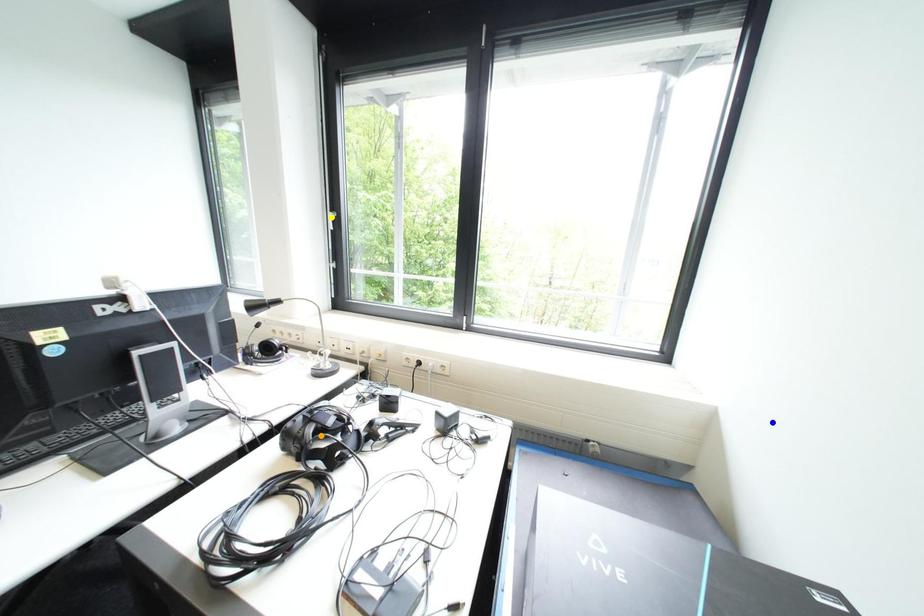
Order these from nearest to farthest:
blue point | orange point | yellow point

blue point, orange point, yellow point